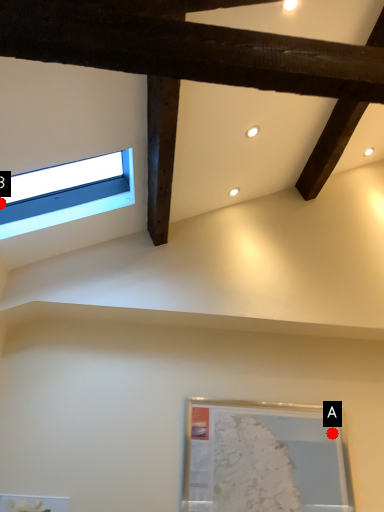
Question: Two points are circled on the image, labeled by A and B beside each circle. Which point is closer to the camera?

Choices:
 (A) A is closer
 (B) B is closer

Answer: (B)